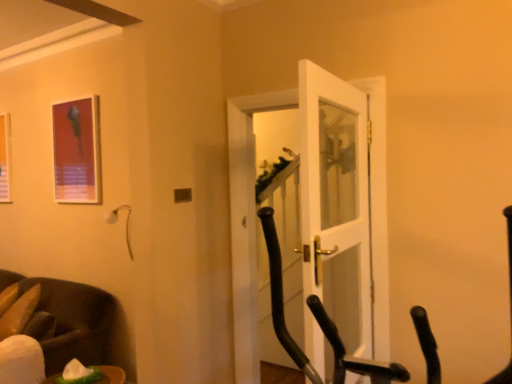
Question: Is dark brown leather chair at lower left located outside metallic frame at upper left, arranged as the first picture frame when viewed from the front?

Choices:
 (A) yes
 (B) no

Answer: (A)

Question: Is dark brown leather chair at lower left directly adjacent to metallic frame at upper left, which is counted as the second picture frame, starting from the back?

Choices:
 (A) no
 (B) yes

Answer: (A)

Question: Is the position of dark brown leather chair at lower left more distant than that of metallic frame at upper left, which ranks as the first picture frame in right-to-left order?

Choices:
 (A) no
 (B) yes

Answer: (A)

Question: Is dark brown leather chair at lower left facing away from metallic frame at upper left, which is counted as the second picture frame, starting from the back?

Choices:
 (A) no
 (B) yes

Answer: (A)

Question: Considering the relative sizes of dark brown leather chair at lower left and metallic frame at upper left, which is counted as the second picture frame, starting from the back, in the image provided, is dark brown leather chair at lower left bigger than metallic frame at upper left, which is counted as the second picture frame, starting from the back,?

Choices:
 (A) no
 (B) yes

Answer: (B)

Question: Does dark brown leather chair at lower left contain metallic frame at upper left, which is counted as the second picture frame, starting from the back?

Choices:
 (A) yes
 (B) no

Answer: (B)

Question: Is white glossy door at center oriented away from matte plastic picture frame at upper left, the 1th picture frame in the left-to-right sequence?

Choices:
 (A) yes
 (B) no

Answer: (B)

Question: Is white glossy door at center smaller than matte plastic picture frame at upper left, placed as the 2th picture frame when sorted from right to left?

Choices:
 (A) yes
 (B) no

Answer: (B)

Question: Considering the relative sizes of white glossy door at center and matte plastic picture frame at upper left, placed as the 2th picture frame when sorted from right to left, in the image provided, is white glossy door at center wider than matte plastic picture frame at upper left, placed as the 2th picture frame when sorted from right to left,?

Choices:
 (A) no
 (B) yes

Answer: (B)

Question: Can you confirm if white glossy door at center is positioned to the left of matte plastic picture frame at upper left, placed as the 2th picture frame when sorted from right to left?

Choices:
 (A) yes
 (B) no

Answer: (B)

Question: From a real-world perspective, is white glossy door at center on top of matte plastic picture frame at upper left, the 1th picture frame in the left-to-right sequence?

Choices:
 (A) no
 (B) yes

Answer: (A)

Question: Would you say white glossy door at center is a long distance from matte plastic picture frame at upper left, the 1th picture frame in the left-to-right sequence?

Choices:
 (A) yes
 (B) no

Answer: (A)

Question: Is metallic frame at upper left, which is counted as the second picture frame, starting from the back, to the left of dark brown leather chair at lower left from the viewer's perspective?

Choices:
 (A) yes
 (B) no

Answer: (B)